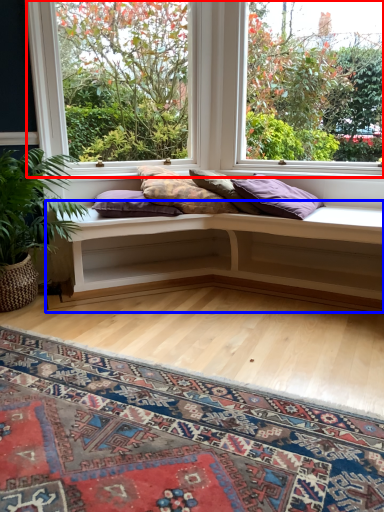
Question: Which object appears closest to the camera in this image, window (highlighted by a red box) or table (highlighted by a blue box)?

Choices:
 (A) window
 (B) table

Answer: (B)